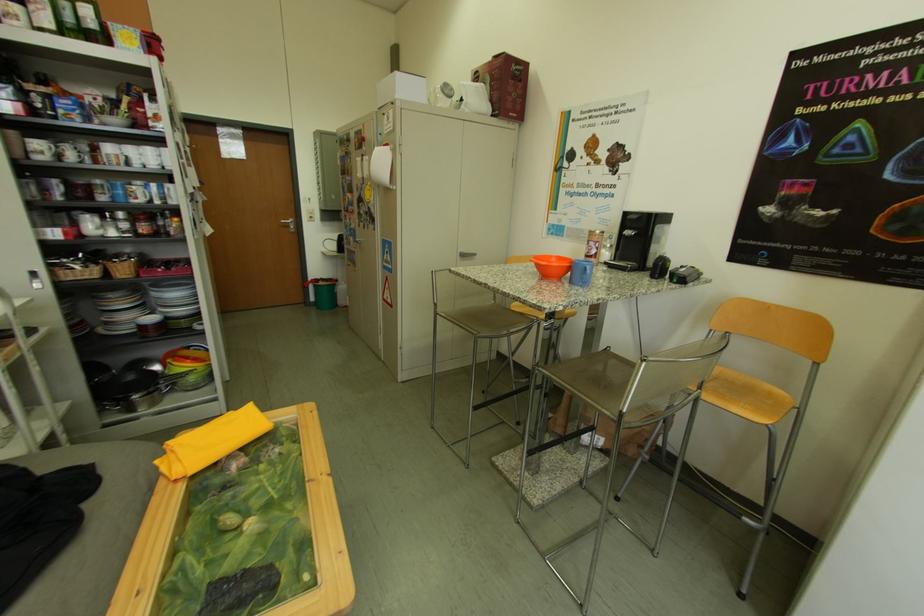
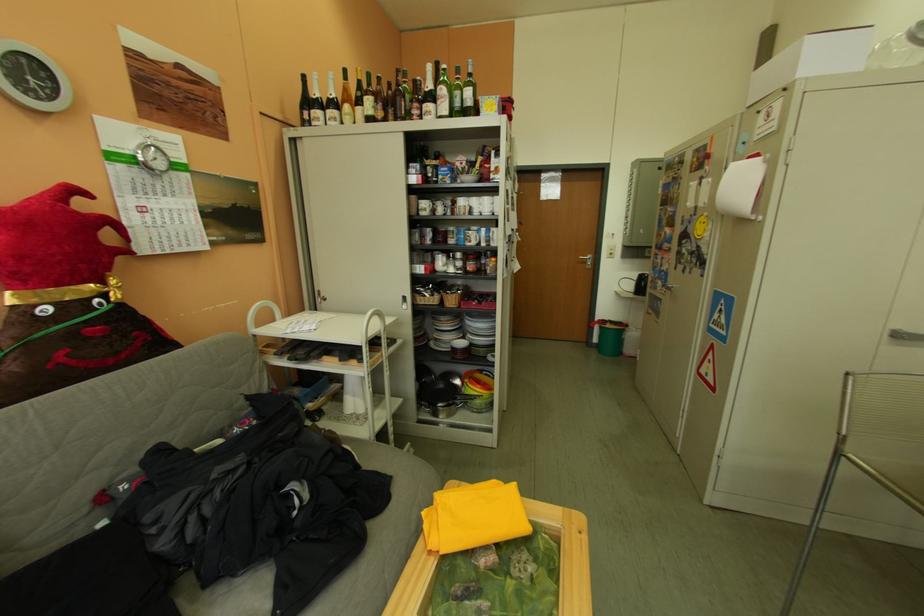
Locate, in the second image, the point that corresponds to the point at 381,177 in the first image.

(720, 204)